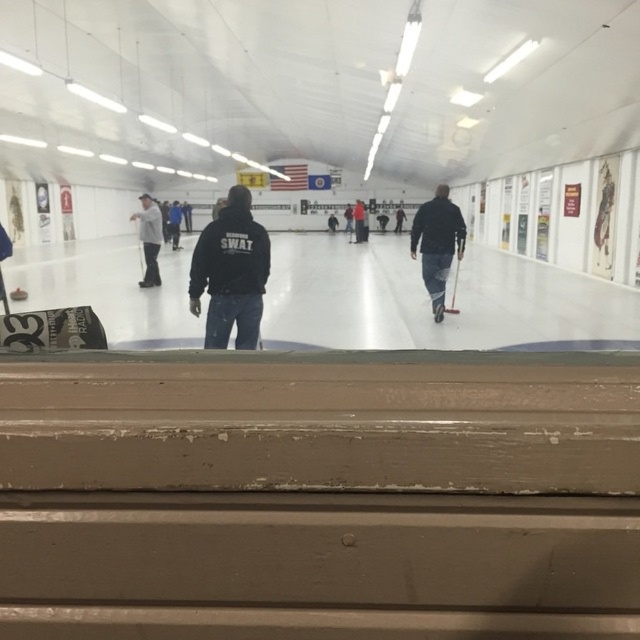
Question: Estimate the real-world distances between objects in this image. Which object is farther from the dark blue jeans at center?

Choices:
 (A) black matte jacket at center
 (B) gray knit cap at left
 (C) dark blue jacket at center

Answer: (C)

Question: Which object is closer to the camera taking this photo?

Choices:
 (A) black matte jacket at center
 (B) dark blue jeans at center
 (C) gray knit cap at left

Answer: (A)

Question: Does black matte jacket at center have a lesser width compared to dark blue jeans at center?

Choices:
 (A) yes
 (B) no

Answer: (A)

Question: Is black matte jacket at center positioned in front of dark blue jeans at center?

Choices:
 (A) no
 (B) yes

Answer: (B)

Question: Considering the relative positions of dark blue jeans at center and dark blue jacket at center in the image provided, where is dark blue jeans at center located with respect to dark blue jacket at center?

Choices:
 (A) left
 (B) right

Answer: (B)

Question: Which point is farther to the camera?

Choices:
 (A) (150, 234)
 (B) (365, 240)
 (C) (260, 292)

Answer: (B)